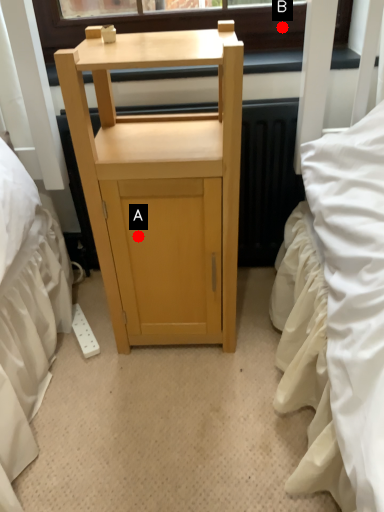
Question: Two points are circled on the image, labeled by A and B beside each circle. Which point is farther to the camera?

Choices:
 (A) A is further
 (B) B is further

Answer: (B)